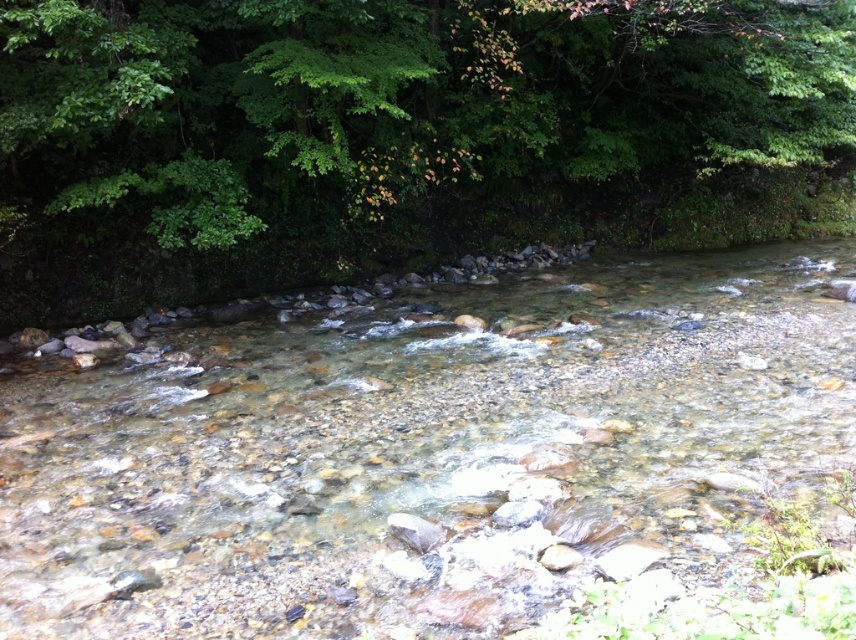
Question: Can you confirm if translucent rocky stream at center is positioned to the right of green leafy tree at upper center?

Choices:
 (A) yes
 (B) no

Answer: (B)

Question: Does translucent rocky stream at center have a greater width compared to green leafy tree at upper center?

Choices:
 (A) yes
 (B) no

Answer: (B)

Question: Which point is farther from the camera taking this photo?

Choices:
 (A) (741, 456)
 (B) (73, 28)

Answer: (B)

Question: Can you confirm if translucent rocky stream at center is thinner than green leafy tree at upper center?

Choices:
 (A) no
 (B) yes

Answer: (B)